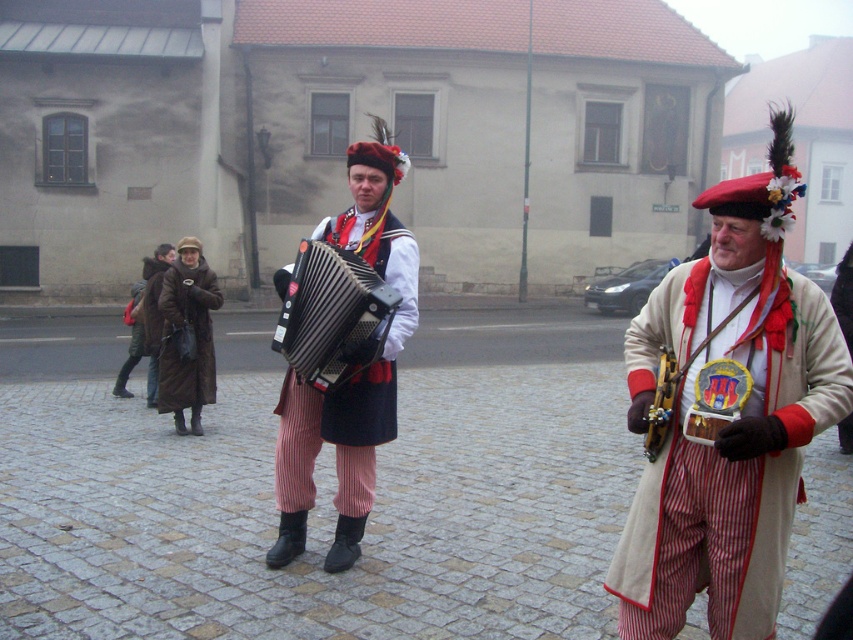
Question: Can you confirm if beige woolen coat at center is positioned above matte black accordion at center?

Choices:
 (A) yes
 (B) no

Answer: (B)

Question: Which of the following is the closest to the observer?

Choices:
 (A) black plastic accordion at center
 (B) matte black accordion at center
 (C) brown leather coat at center

Answer: (A)

Question: Does beige woolen coat at center lie in front of black plastic accordion at center?

Choices:
 (A) no
 (B) yes

Answer: (B)

Question: Estimate the real-world distances between objects in this image. Which object is closer to the brown leather coat at center?

Choices:
 (A) beige woolen coat at center
 (B) matte black accordion at center

Answer: (B)

Question: Considering the real-world distances, which object is farthest from the beige woolen coat at center?

Choices:
 (A) black plastic accordion at center
 (B) matte black accordion at center
 (C) brown leather coat at center

Answer: (C)

Question: Can you confirm if matte black accordion at center is positioned above black plastic accordion at center?

Choices:
 (A) yes
 (B) no

Answer: (B)